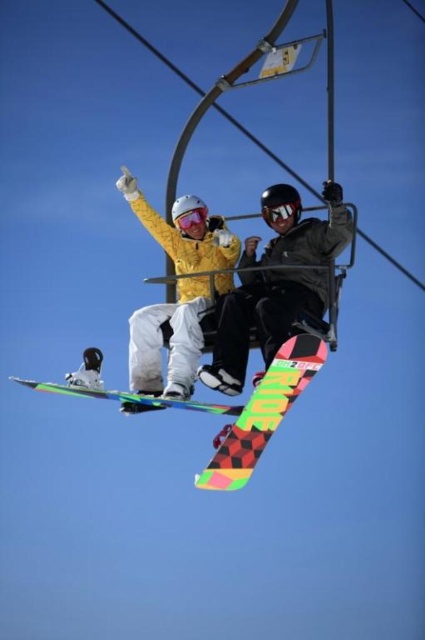
Between matte black snowboard at center and neon checkered snowboard at center, which one is positioned lower?

neon checkered snowboard at center is below.

Image resolution: width=425 pixels, height=640 pixels. What do you see at coordinates (277, 291) in the screenshot?
I see `matte black snowboard at center` at bounding box center [277, 291].

Is point (303, 273) more distant than point (308, 380)?

Yes, point (303, 273) is behind point (308, 380).

Where is `matte black snowboard at center`? The height and width of the screenshot is (640, 425). matte black snowboard at center is located at coordinates (277, 291).

Which is in front, point (96, 388) or point (181, 212)?

Point (96, 388) is in front.

Can you confirm if multicolored checkered snowboard at center is bigger than matte pink goggles at center?

No, multicolored checkered snowboard at center is not bigger than matte pink goggles at center.

Does point (172, 403) come closer to viewer compared to point (172, 216)?

That is True.

The image size is (425, 640). I want to click on multicolored checkered snowboard at center, so click(x=130, y=397).

Who is positioned more to the right, matte black snowboard at center or black matte goggles at upper center?

matte black snowboard at center is more to the right.

Can you confirm if matte black snowboard at center is positioned below black matte goggles at upper center?

Yes.

You are a GUI agent. You are given a task and a screenshot of the screen. Output one action in this format:
    pyautogui.click(x=<x>, y=<y>)
    Task: Click on the matte black snowboard at center
    This screenshot has height=640, width=425.
    Given the screenshot: What is the action you would take?
    pyautogui.click(x=277, y=291)